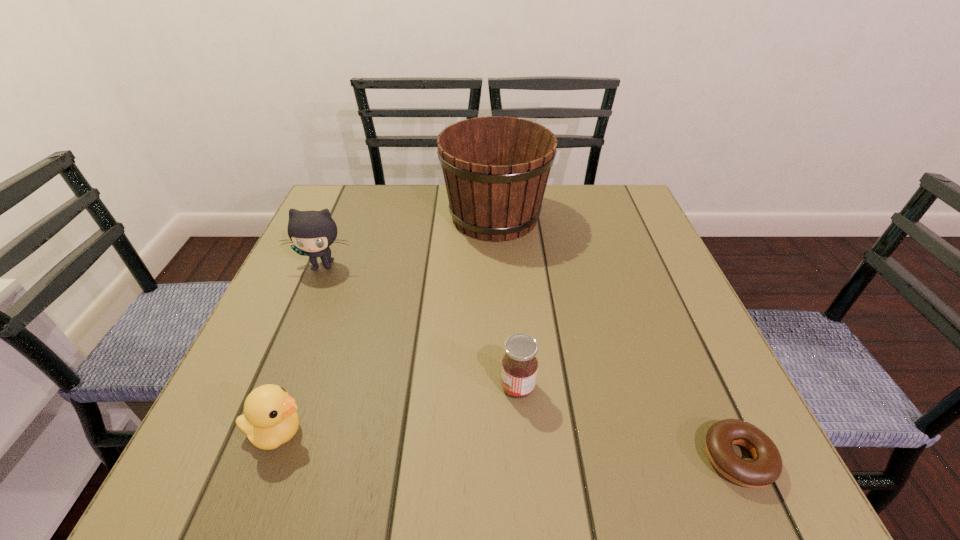
The height and width of the screenshot is (540, 960). I want to click on the farthest object, so click(496, 169).

Find the location of a particular element. This screenshot has width=960, height=540. wine bucket is located at coordinates (496, 169).

You are a GUI agent. You are given a task and a screenshot of the screen. Output one action in this format:
    pyautogui.click(x=<x>, y=<y>)
    Task: Click on the fourth nearest object
    The image size is (960, 540).
    Given the screenshot: What is the action you would take?
    pyautogui.click(x=312, y=232)

Where is `the fourth shortest object`? Image resolution: width=960 pixels, height=540 pixels. the fourth shortest object is located at coordinates (312, 232).

The height and width of the screenshot is (540, 960). In order to click on jam in this screenshot , I will do `click(519, 369)`.

Where is `duck`? duck is located at coordinates (270, 418).

Where is `the rightmost object`? Image resolution: width=960 pixels, height=540 pixels. the rightmost object is located at coordinates (766, 468).

This screenshot has height=540, width=960. In order to click on doughnut in this screenshot , I will do `click(766, 468)`.

Where is `free space located on the front of the farthest object`? This screenshot has width=960, height=540. free space located on the front of the farthest object is located at coordinates (497, 262).

I want to click on free spot located 0.320m on the front-facing side of the second tallest object, so click(x=264, y=406).